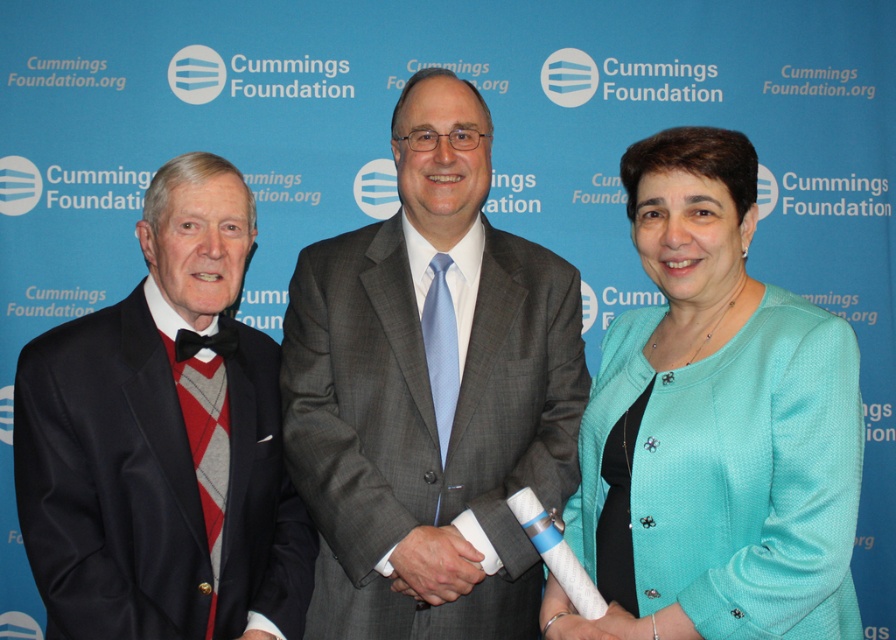
Question: Which point is closer to the camera?

Choices:
 (A) (728, 132)
 (B) (369, 243)
 (C) (181, 561)

Answer: (A)

Question: Which of the following is the closest to the observer?

Choices:
 (A) black satin suit at left
 (B) teal fabric jacket at center

Answer: (B)

Question: Among these points, which one is farthest from the camera?

Choices:
 (A) (158, 211)
 (B) (490, 140)
 (C) (819, 424)

Answer: (B)

Question: Is gray textured suit at center to the right of teal fabric jacket at center from the viewer's perspective?

Choices:
 (A) yes
 (B) no

Answer: (B)

Question: Can you confirm if gray textured suit at center is positioned to the right of black satin suit at left?

Choices:
 (A) no
 (B) yes

Answer: (B)

Question: Is gray textured suit at center to the left of black satin suit at left from the viewer's perspective?

Choices:
 (A) no
 (B) yes

Answer: (A)